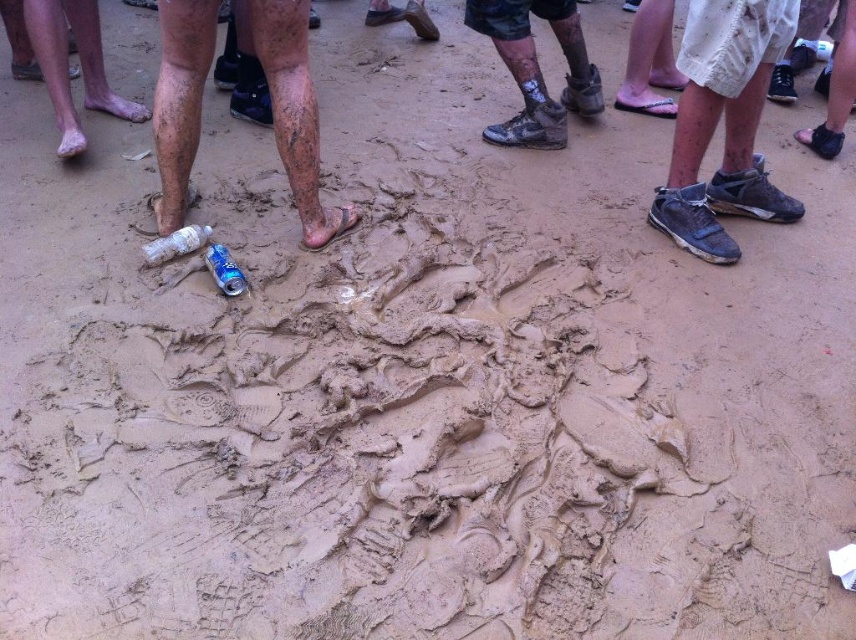
Question: Which is nearer to the dirty gray sneakers at lower right?

Choices:
 (A) translucent plastic bottle at lower left
 (B) bare skin at lower left
 (C) blue metallic can at center

Answer: (C)

Question: Which object is the farthest from the bare skin at lower left?

Choices:
 (A) muddy skin legs at lower center
 (B) blue metallic can at center
 (C) translucent plastic bottle at lower left

Answer: (B)

Question: Observing the image, what is the correct spatial positioning of bare skin at lower left in reference to translucent plastic bottle at lower left?

Choices:
 (A) below
 (B) above

Answer: (B)

Question: Is the position of bare skin at lower left more distant than that of blue metallic can at center?

Choices:
 (A) no
 (B) yes

Answer: (B)

Question: Is muddy skin legs at lower center further to the viewer compared to translucent plastic bottle at lower left?

Choices:
 (A) yes
 (B) no

Answer: (B)

Question: Which is nearer to the muddy skin legs at lower center?

Choices:
 (A) dirty gray sneakers at lower right
 (B) bare skin at lower left

Answer: (B)